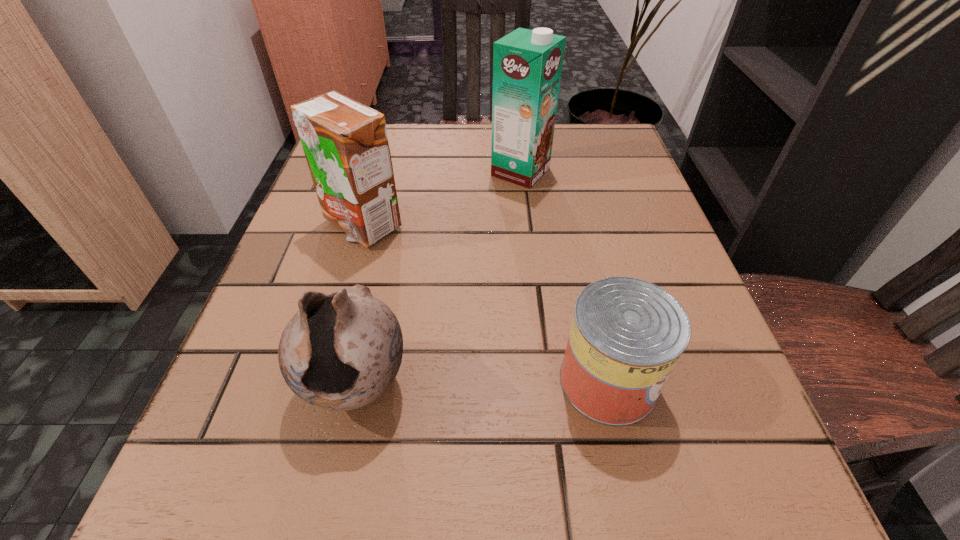
Find the location of a particular element. This screenshot has width=960, height=540. object that is at the far edge is located at coordinates (527, 64).

Locate an element on the screen. This screenshot has width=960, height=540. carton present at the left edge is located at coordinates (345, 143).

In order to click on pottery present at the left edge in this screenshot , I will do `click(342, 350)`.

Locate an element on the screen. The image size is (960, 540). object at the right edge is located at coordinates (627, 335).

Identify the location of free region at the far edge of the desktop. This screenshot has height=540, width=960. (477, 158).

Identify the location of vacant space at the near edge. (476, 475).

In the image, there is a desktop. Identify the location of vacant space at the left edge. Image resolution: width=960 pixels, height=540 pixels. (320, 414).

This screenshot has width=960, height=540. I want to click on vacant space at the right edge of the desktop, so click(x=676, y=255).

Locate an element on the screen. free space at the near left corner of the desktop is located at coordinates (256, 495).

You are a GUI agent. You are given a task and a screenshot of the screen. Output one action in this format:
    pyautogui.click(x=<x>, y=<y>)
    Task: Click on the free region at the far right corner of the desktop
    This screenshot has height=540, width=960.
    Given the screenshot: What is the action you would take?
    pyautogui.click(x=567, y=158)